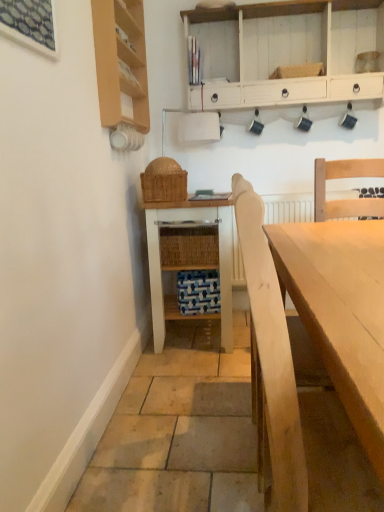
Question: Considering the positions of wooden shelf at upper left and white painted wood table at center in the image, is wooden shelf at upper left bigger or smaller than white painted wood table at center?

Choices:
 (A) big
 (B) small

Answer: (B)

Question: Considering their positions, is wooden shelf at upper left located in front of or behind white painted wood table at center?

Choices:
 (A) behind
 (B) front

Answer: (B)

Question: Considering the real-world distances, which object is closest to the white wood cabinet at upper center?

Choices:
 (A) woven brown picnic basket at center
 (B) light wood table at center
 (C) white painted wood table at center
 (D) wooden shelf at upper left

Answer: (D)

Question: Which is farther from the white painted wood table at center?

Choices:
 (A) light wood table at center
 (B) wooden shelf at upper left
 (C) woven brown picnic basket at center
 (D) white wood cabinet at upper center

Answer: (D)